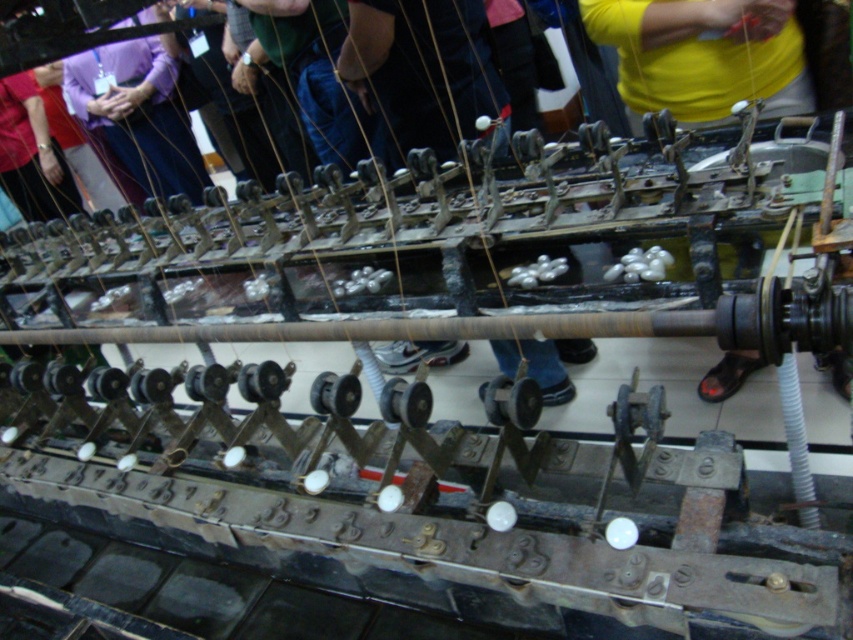
Does yellow cotton shirt at upper center have a greater width compared to yellow fabric at center?

Indeed, yellow cotton shirt at upper center has a greater width compared to yellow fabric at center.

Who is more distant from viewer, (532, 209) or (769, 10)?

Point (769, 10)

Locate an element on the screen. The width and height of the screenshot is (853, 640). yellow cotton shirt at upper center is located at coordinates (483, 230).

Who is positioned more to the left, yellow fabric at center or denim jeans at center?

From the viewer's perspective, denim jeans at center appears more on the left side.

Can you confirm if yellow fabric at center is positioned above denim jeans at center?

No.

Which is in front, point (618, 60) or point (422, 129)?

Positioned in front is point (422, 129).

In order to click on yellow fabric at center in this screenshot , I will do `click(703, 54)`.

What do you see at coordinates (483, 230) in the screenshot?
I see `yellow cotton shirt at upper center` at bounding box center [483, 230].

Between yellow cotton shirt at upper center and denim jeans at center, which one is positioned lower?

yellow cotton shirt at upper center is below.

Between point (361, 38) and point (399, 356), which one is positioned behind?

The point (399, 356) is more distant.

At what (x,y) coordinates should I click in order to perform the action: click on yellow cotton shirt at upper center. Please return your answer as a coordinate pair (x, y). The image size is (853, 640). Looking at the image, I should click on (483, 230).